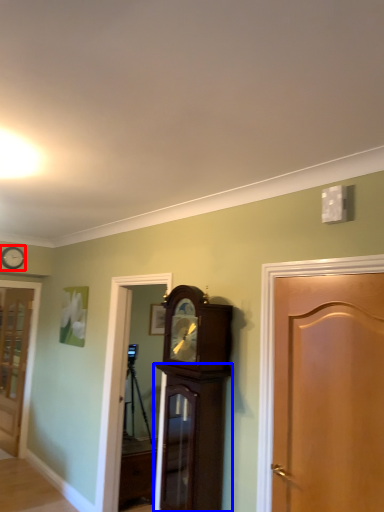
Question: Among these objects, which one is farthest to the camera, clock (highlighted by a red box) or cabinetry (highlighted by a blue box)?

Choices:
 (A) clock
 (B) cabinetry

Answer: (A)